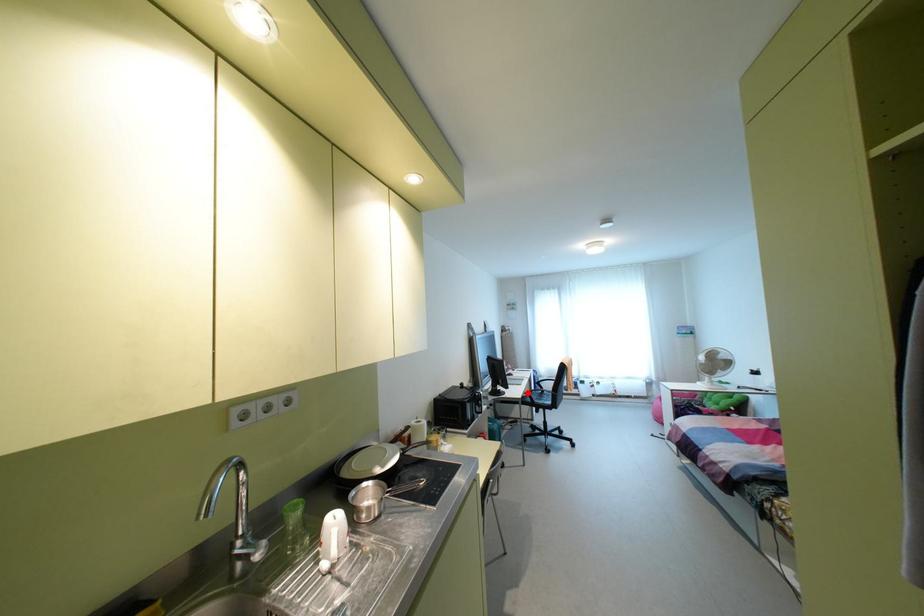
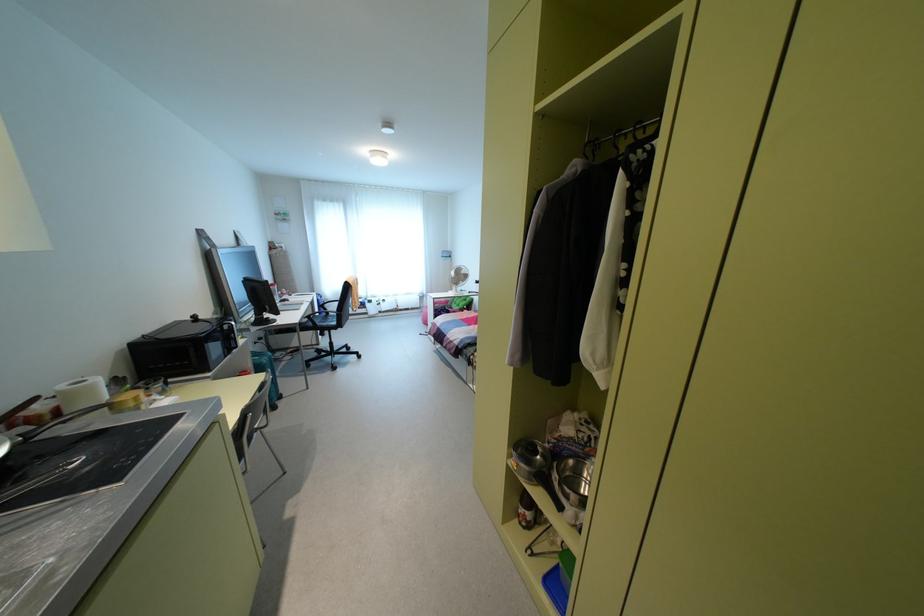
Where in the second image is the point corresponding to the highlighted location from the first image?

(309, 315)